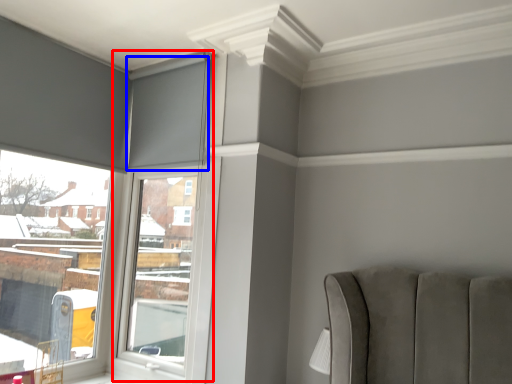
Question: Which object appears closest to the camera in this image, window frame (highlighted by a red box) or curtain (highlighted by a blue box)?

Choices:
 (A) window frame
 (B) curtain

Answer: (A)